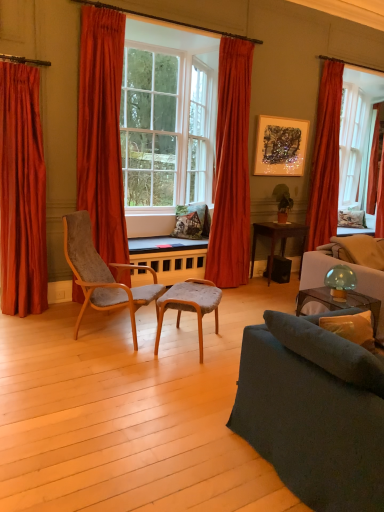
Find the location of a particular element. This screenshot has width=384, height=512. vacant region above satin red curtain at left, which is the first curtain from left to right (from a real-world perspective) is located at coordinates (16, 60).